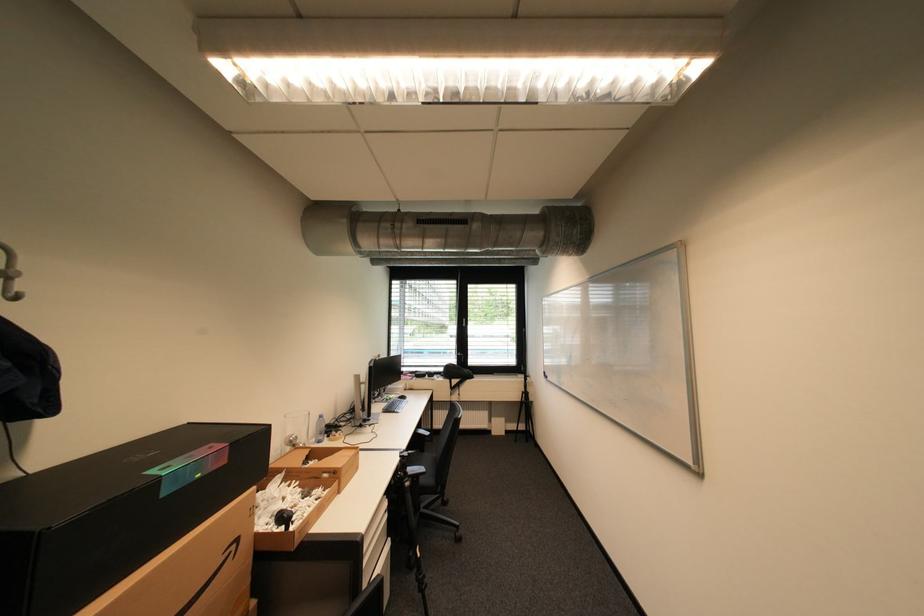
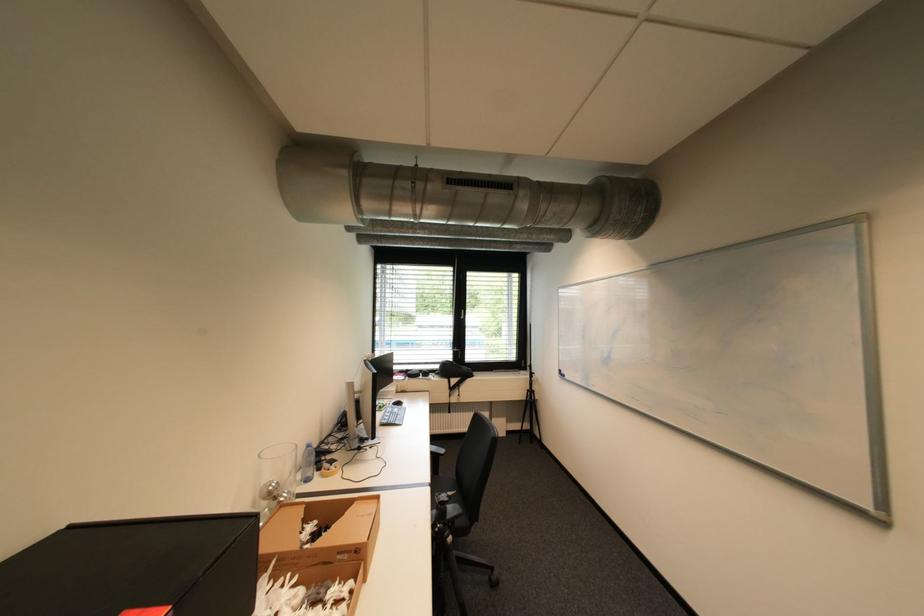
Question: I am providing you with two images of the same scene from different viewpoints. Please identify which objects are invisible in image2.

Choices:
 (A) black chair armrest
 (B) glass jar
 (C) plastic water bottle
 (D) none of these

Answer: (D)